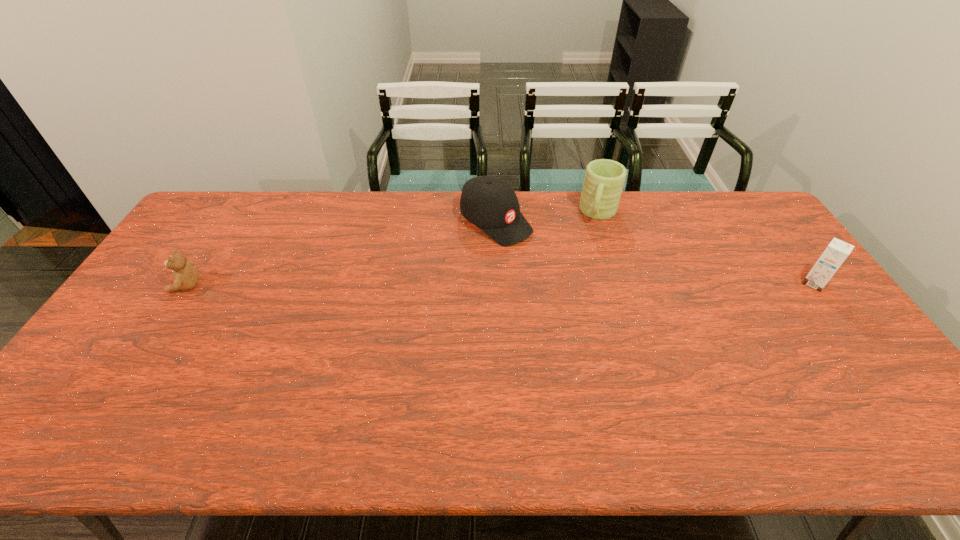
The image size is (960, 540). Find the location of `vacant region between the baseball cap and the mug`. vacant region between the baseball cap and the mug is located at coordinates (547, 218).

Find the location of `object identified as the closest to the mug`. object identified as the closest to the mug is located at coordinates (491, 204).

The width and height of the screenshot is (960, 540). What are the coordinates of `object that stands as the second closest to the baseball cap` in the screenshot? It's located at (185, 275).

You are a GUI agent. You are given a task and a screenshot of the screen. Output one action in this format:
    pyautogui.click(x=<x>, y=<y>)
    Task: Click on the vacant space that satisfies the following two spatial constraints: 1. on the back side of the second object from right to left; 2. on the left side of the baseball cap
    This screenshot has height=540, width=960.
    Given the screenshot: What is the action you would take?
    pyautogui.click(x=495, y=213)

The height and width of the screenshot is (540, 960). I want to click on vacant space that satisfies the following two spatial constraints: 1. on the back side of the mug; 2. on the right side of the baseball cap, so click(x=495, y=213).